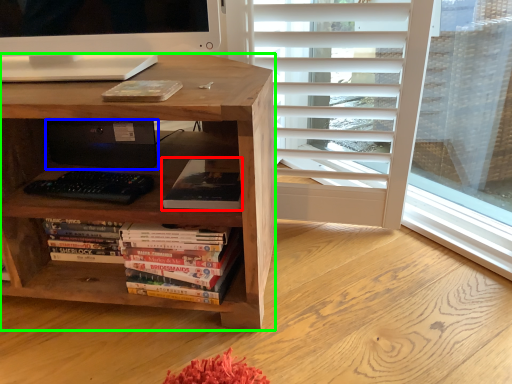
Question: Which object is positioned farthest from book (highlighted by a red box)? Select from computer (highlighted by a blue box) and desk (highlighted by a green box).

Choices:
 (A) computer
 (B) desk

Answer: (A)